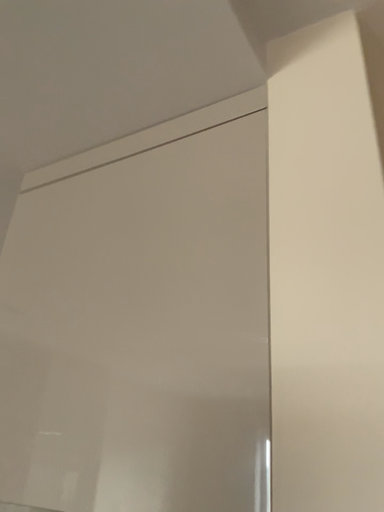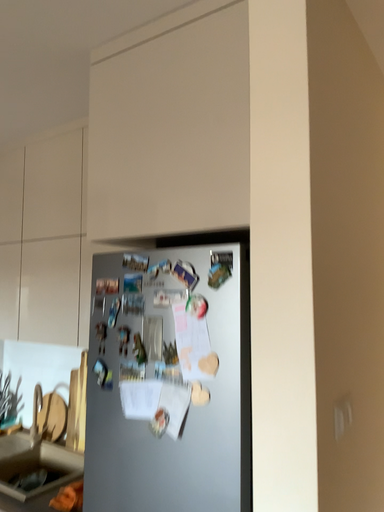
Question: Which way did the camera rotate in the video?

Choices:
 (A) rotated upward
 (B) rotated downward

Answer: (B)